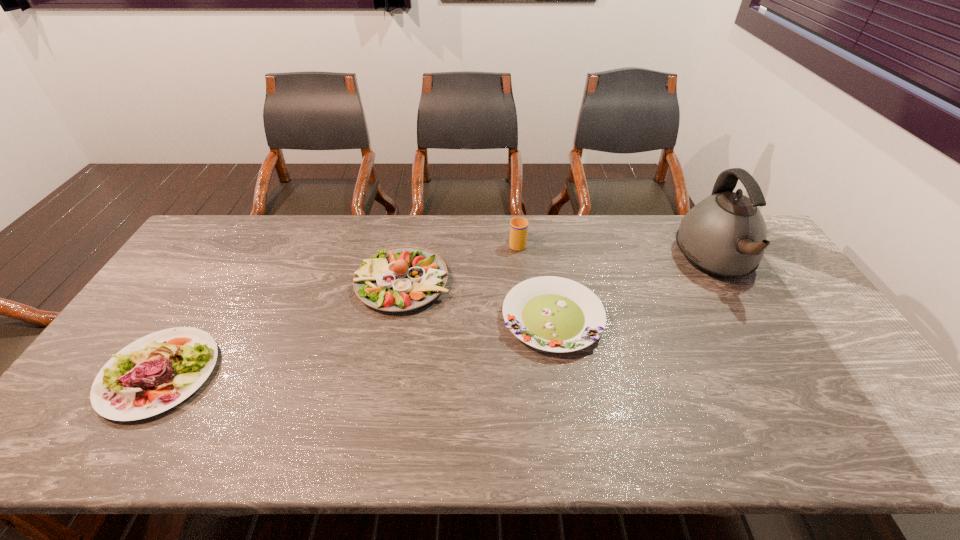
Find the location of a particular element. The height and width of the screenshot is (540, 960). free space located on the side of the cup with the handle is located at coordinates coord(516,221).

Image resolution: width=960 pixels, height=540 pixels. Identify the location of free space located on the side of the cup with the handle. (516, 224).

Identify the location of vacant space located 0.080m on the side of the cup with the handle. The width and height of the screenshot is (960, 540). (516, 222).

I want to click on vacant area located 0.320m on the left of the fourth object from right to left, so click(x=252, y=282).

I want to click on vacant space located 0.210m on the right of the leftmost object, so click(x=298, y=374).

Find the location of a particular element. Image resolution: width=960 pixels, height=540 pixels. free space located on the left of the shortest salad plate is located at coordinates (383, 319).

This screenshot has width=960, height=540. Identify the location of kettle present at the far edge. (724, 236).

The width and height of the screenshot is (960, 540). Find the location of `cup present at the far edge`. cup present at the far edge is located at coordinates (518, 226).

Image resolution: width=960 pixels, height=540 pixels. Find the location of `salad plate situated at the far edge`. salad plate situated at the far edge is located at coordinates (x=399, y=279).

In order to click on object that is at the near edge in this screenshot , I will do [129, 386].